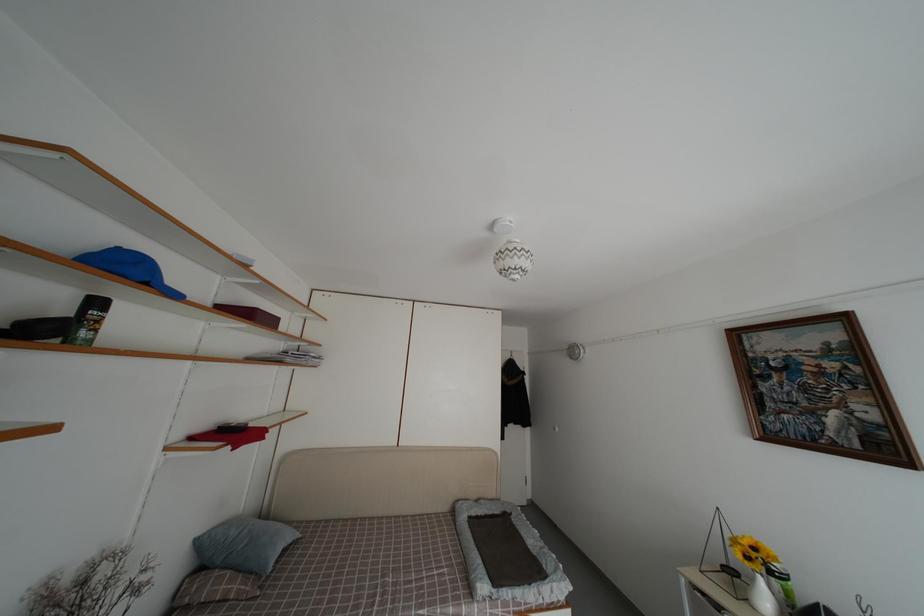
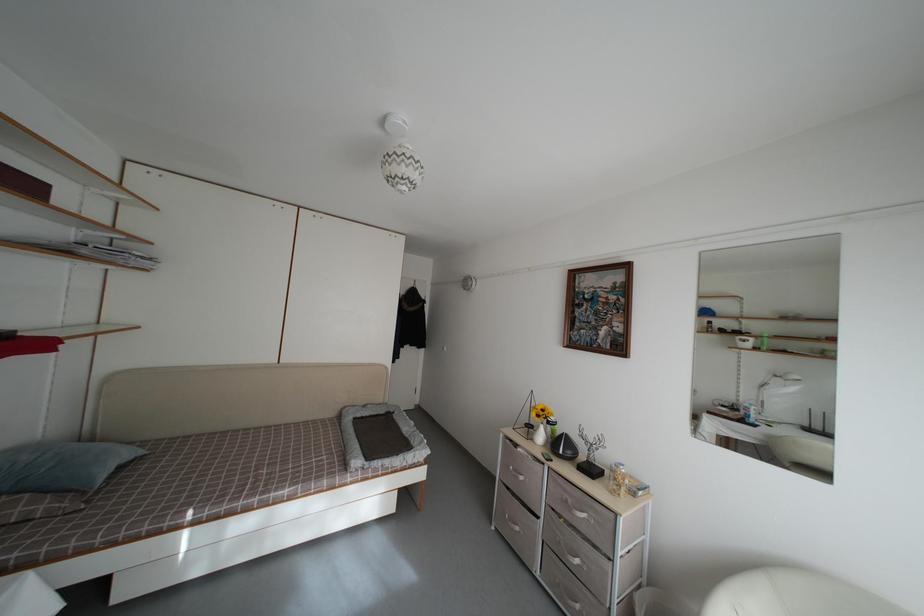
Question: The camera is either moving clockwise (left) or counter-clockwise (right) around the object. The first image is from the beginning of the video and the second image is from the end. Is the camera moving left or right when shooting the video?

Choices:
 (A) Left
 (B) Right

Answer: (A)